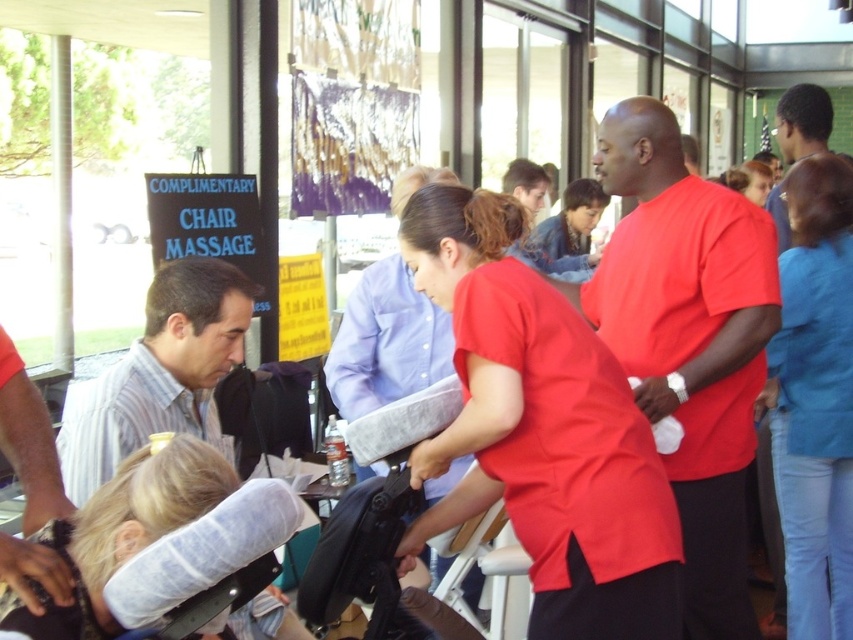
Question: In this image, where is matte red shirt at center located relative to blonde hair at center?

Choices:
 (A) left
 (B) right

Answer: (B)

Question: Based on their relative distances, which object is nearer to the blue denim jeans at right?

Choices:
 (A) matte red shirt at center
 (B) blonde hair at center

Answer: (A)

Question: Which object appears farthest from the camera in this image?

Choices:
 (A) matte red shirt at center
 (B) blue denim jeans at right

Answer: (B)

Question: Which point is farther to the camera?

Choices:
 (A) (172, 451)
 (B) (474, 256)
 (C) (846, 212)

Answer: (C)

Question: Is matte red shirt at center smaller than blonde hair at center?

Choices:
 (A) yes
 (B) no

Answer: (B)

Question: Is matte red shirt at center further to the viewer compared to blonde hair at center?

Choices:
 (A) no
 (B) yes

Answer: (B)